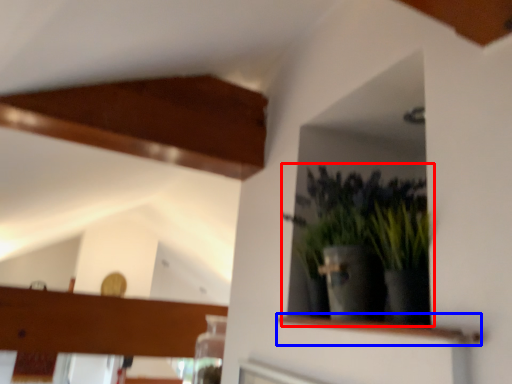
Question: Which object is further to the camera taking this photo, houseplant (highlighted by a red box) or shelf (highlighted by a blue box)?

Choices:
 (A) houseplant
 (B) shelf

Answer: (A)